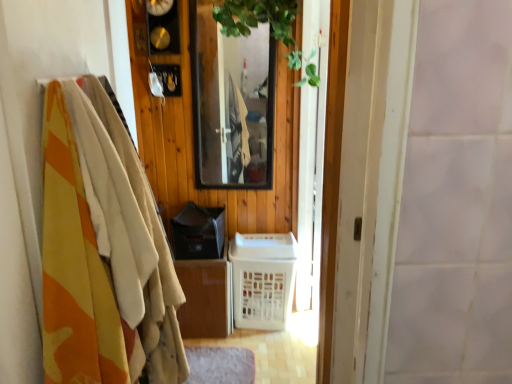
The image size is (512, 384). What are the coordinates of `vacant space to the right of gray soft mat at lower center` in the screenshot? It's located at (276, 348).